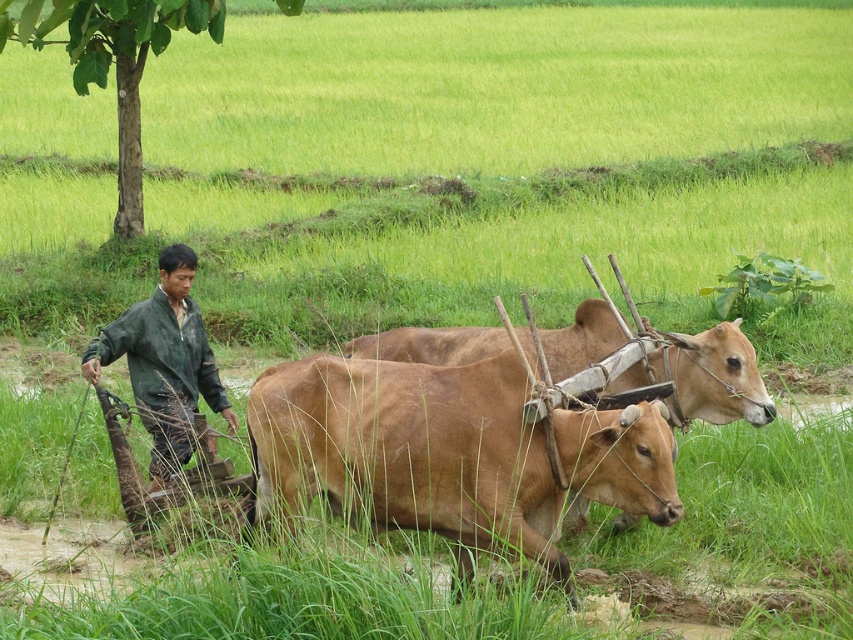
Can you confirm if brown smooth cow at center is bigger than green matte jacket at left?

Indeed, brown smooth cow at center has a larger size compared to green matte jacket at left.

Is point (622, 451) closer to camera compared to point (149, 348)?

Yes.

Is point (421, 381) positioned in front of point (141, 420)?

Yes.

The width and height of the screenshot is (853, 640). Identify the location of brown smooth cow at center. (409, 451).